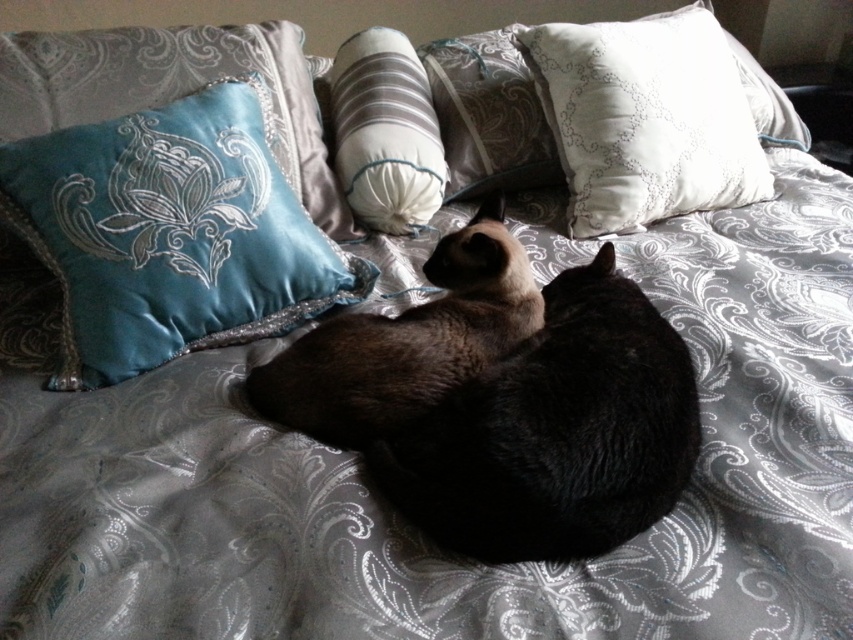
Does point (416, 230) come in front of point (460, 49)?

That is True.

Which is in front, point (357, 192) or point (515, 147)?

Point (357, 192) is more forward.

Describe the element at coordinates (386, 132) in the screenshot. The image size is (853, 640). I see `white soft pillow at center` at that location.

Locate an element on the screen. white soft pillow at center is located at coordinates (386, 132).

Can you confirm if white satin pillow at upper right is shorter than satin brown cat at center?

In fact, white satin pillow at upper right may be taller than satin brown cat at center.

The width and height of the screenshot is (853, 640). Find the location of `white satin pillow at upper right`. white satin pillow at upper right is located at coordinates [x=646, y=118].

Where is `white satin pillow at upper right`? white satin pillow at upper right is located at coordinates (646, 118).

Which is more to the left, white satin pillow at upper right or silky white pillow at center?

From the viewer's perspective, silky white pillow at center appears more on the left side.

Is point (567, 88) positioned after point (479, 90)?

No, it is not.

Which is in front, point (732, 172) or point (544, 161)?

Positioned in front is point (732, 172).

Identify the location of white satin pillow at upper right. The width and height of the screenshot is (853, 640). (646, 118).